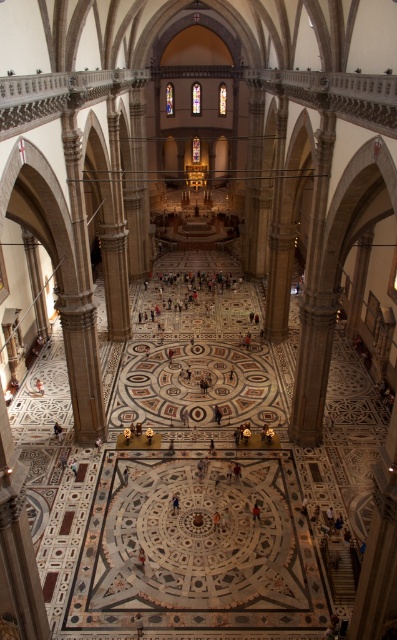
Is red fabric person at center below dark brown leather shoe at center?

Yes.

Is red fabric person at center thinner than dark brown leather shoe at center?

In fact, red fabric person at center might be wider than dark brown leather shoe at center.

Does point (144, 566) lie in front of point (177, 496)?

Yes, it is in front of point (177, 496).

The width and height of the screenshot is (397, 640). In order to click on red fabric person at center in this screenshot , I will do `click(142, 557)`.

Does point (138, 552) come behind point (73, 474)?

No.

Is red fabric person at center positioned before light brown wooden chair at center?

Yes.

Which is in front, point (140, 557) or point (75, 474)?

Point (140, 557)

I want to click on red fabric person at center, so click(x=142, y=557).

Does dark blue fabric at center have a greater width compared to light brown wooden chair at center?

In fact, dark blue fabric at center might be narrower than light brown wooden chair at center.

Does dark blue fabric at center appear on the right side of light brown wooden chair at center?

Indeed, dark blue fabric at center is positioned on the right side of light brown wooden chair at center.

Between point (256, 516) and point (75, 472), which one is positioned behind?

The point (75, 472) is behind.

Where is `dark blue fabric at center`? dark blue fabric at center is located at coordinates (256, 513).